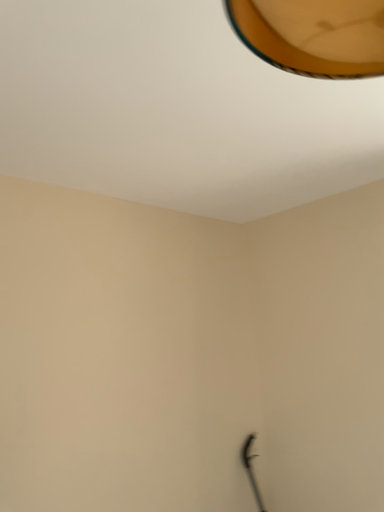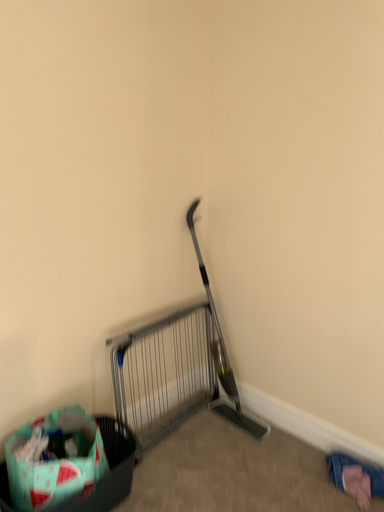
Question: How did the camera likely rotate when shooting the video?

Choices:
 (A) rotated downward
 (B) rotated upward

Answer: (A)